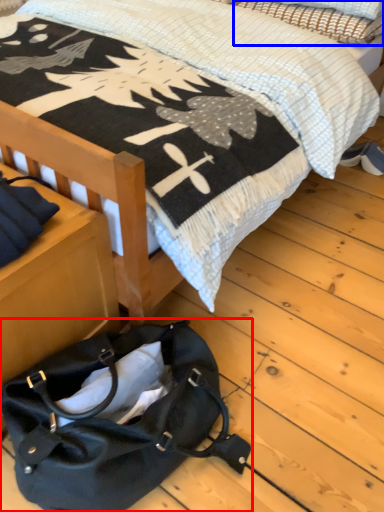
Question: Which point is further to the camera, handbag (highlighted by a red box) or pillow (highlighted by a blue box)?

Choices:
 (A) handbag
 (B) pillow

Answer: (B)